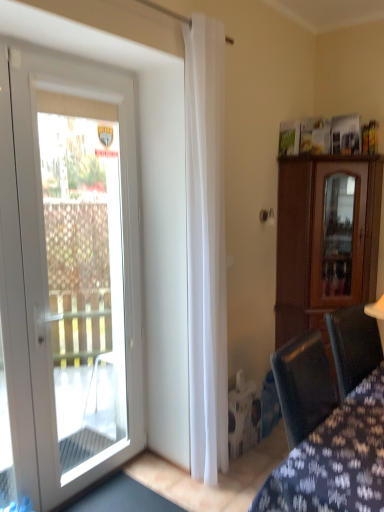
Question: From the image's perspective, is velvet dark blue chair at lower right positioned above or below white glass door at left?

Choices:
 (A) below
 (B) above

Answer: (A)

Question: From a real-world perspective, is velvet dark blue chair at lower right positioned above or below white glass door at left?

Choices:
 (A) below
 (B) above

Answer: (A)

Question: Which is nearer to the velvet dark blue chair at lower right?

Choices:
 (A) white sheer curtain at center
 (B) brown wooden cabinet at right
 (C) white glass door at left

Answer: (A)

Question: Considering the real-world distances, which object is closest to the white sheer curtain at center?

Choices:
 (A) white glass door at left
 (B) velvet dark blue chair at lower right
 (C) brown wooden cabinet at right

Answer: (A)